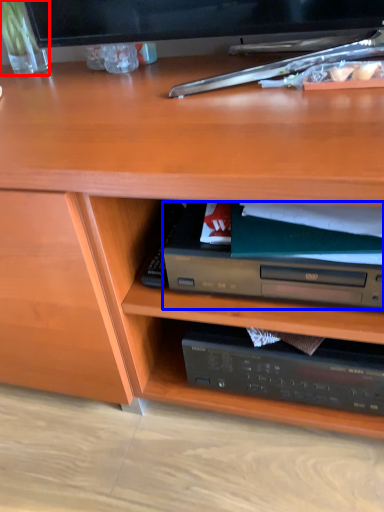
Question: Which object appears farthest to the camera in this image, glass vase (highlighted by a red box) or paperback book (highlighted by a blue box)?

Choices:
 (A) glass vase
 (B) paperback book

Answer: (A)